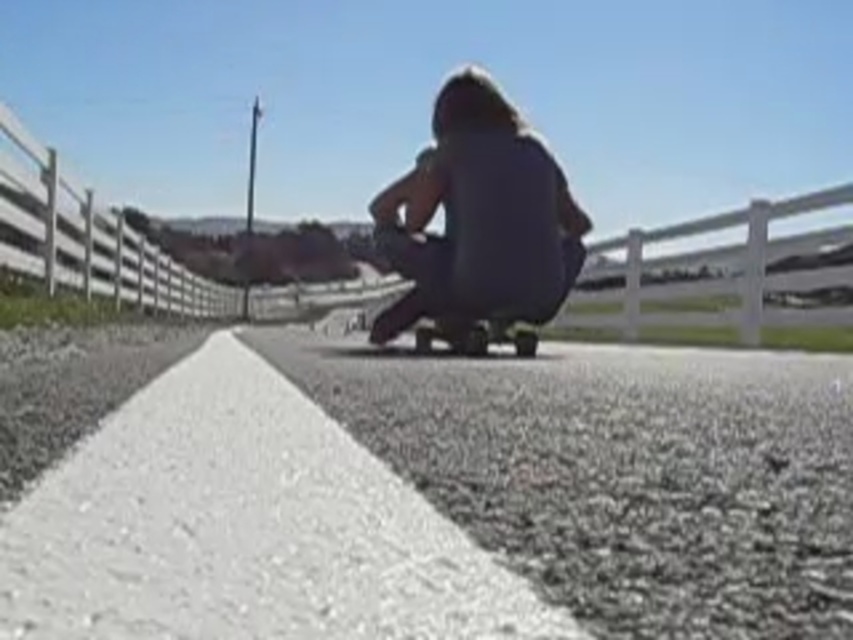
Can you confirm if matte gray hoodie at center is positioned to the right of smooth black skateboard at center?

No, matte gray hoodie at center is not to the right of smooth black skateboard at center.

Which is in front, point (482, 246) or point (418, 321)?

Positioned in front is point (482, 246).

Who is more distant from viewer, (514,211) or (469,346)?

The point (469,346) is behind.

In order to click on matte gray hoodie at center in this screenshot , I will do `click(479, 218)`.

Can you confirm if white wooden fence at center is bigger than smooth black skateboard at center?

Yes.

Does white wooden fence at center come in front of smooth black skateboard at center?

No, it is not.

Find the location of a particular element. The height and width of the screenshot is (640, 853). white wooden fence at center is located at coordinates (90, 241).

Who is more forward, (x=531, y=132) or (x=45, y=156)?

Point (x=531, y=132)

Is point (520, 244) behind point (10, 186)?

No, (520, 244) is closer to viewer.

The image size is (853, 640). What are the coordinates of `matte gray hoodie at center` in the screenshot? It's located at (479, 218).

Find the location of a particular element. The height and width of the screenshot is (640, 853). matte gray hoodie at center is located at coordinates (479, 218).